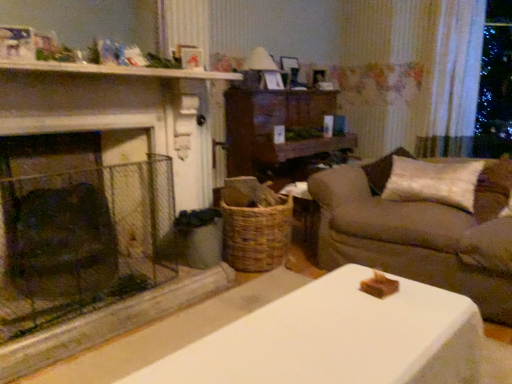
Question: From a real-world perspective, is velvet beige pillow at right on matte white lampshade at upper center?

Choices:
 (A) yes
 (B) no

Answer: (B)

Question: Does velvet beige pillow at right have a lesser width compared to matte white lampshade at upper center?

Choices:
 (A) no
 (B) yes

Answer: (A)

Question: Would you say velvet beige pillow at right contains matte white lampshade at upper center?

Choices:
 (A) no
 (B) yes

Answer: (A)

Question: Considering the relative sizes of velvet beige pillow at right and matte white lampshade at upper center in the image provided, is velvet beige pillow at right bigger than matte white lampshade at upper center?

Choices:
 (A) yes
 (B) no

Answer: (A)

Question: Is velvet beige pillow at right to the left of matte white lampshade at upper center from the viewer's perspective?

Choices:
 (A) no
 (B) yes

Answer: (A)

Question: Is velvet beige pillow at right not within matte white lampshade at upper center?

Choices:
 (A) no
 (B) yes

Answer: (B)

Question: Would you say white sheer curtain at upper right is outside white painted wood mantle at upper center?

Choices:
 (A) no
 (B) yes

Answer: (B)

Question: From the image's perspective, is white sheer curtain at upper right beneath white painted wood mantle at upper center?

Choices:
 (A) no
 (B) yes

Answer: (A)

Question: Does white sheer curtain at upper right have a lesser width compared to white painted wood mantle at upper center?

Choices:
 (A) yes
 (B) no

Answer: (A)

Question: Considering the relative positions of white sheer curtain at upper right and white painted wood mantle at upper center in the image provided, is white sheer curtain at upper right behind white painted wood mantle at upper center?

Choices:
 (A) no
 (B) yes

Answer: (B)

Question: Is white sheer curtain at upper right at the right side of white painted wood mantle at upper center?

Choices:
 (A) no
 (B) yes

Answer: (B)

Question: Would you say white sheer curtain at upper right is a long distance from white painted wood mantle at upper center?

Choices:
 (A) no
 (B) yes

Answer: (B)

Question: From the image's perspective, is beige fabric couch at right above white painted wood mantle at upper center?

Choices:
 (A) no
 (B) yes

Answer: (A)